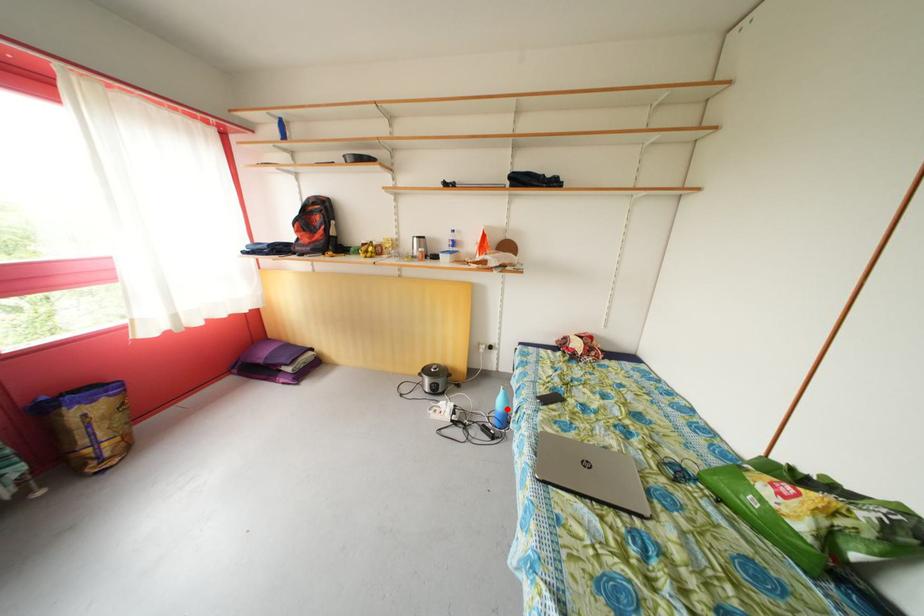
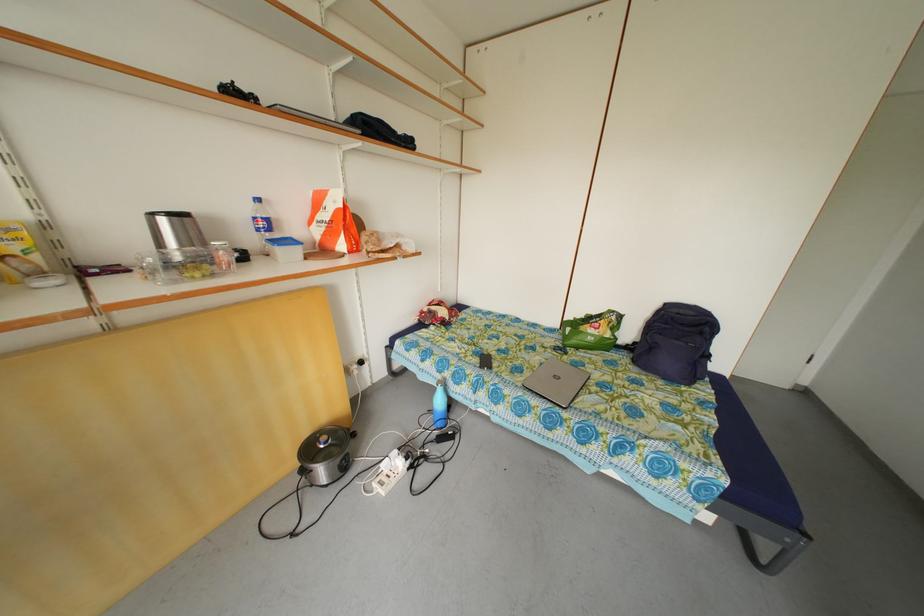
In the second image, find the point that corresponds to the highlighted location in the first image.

(446, 408)